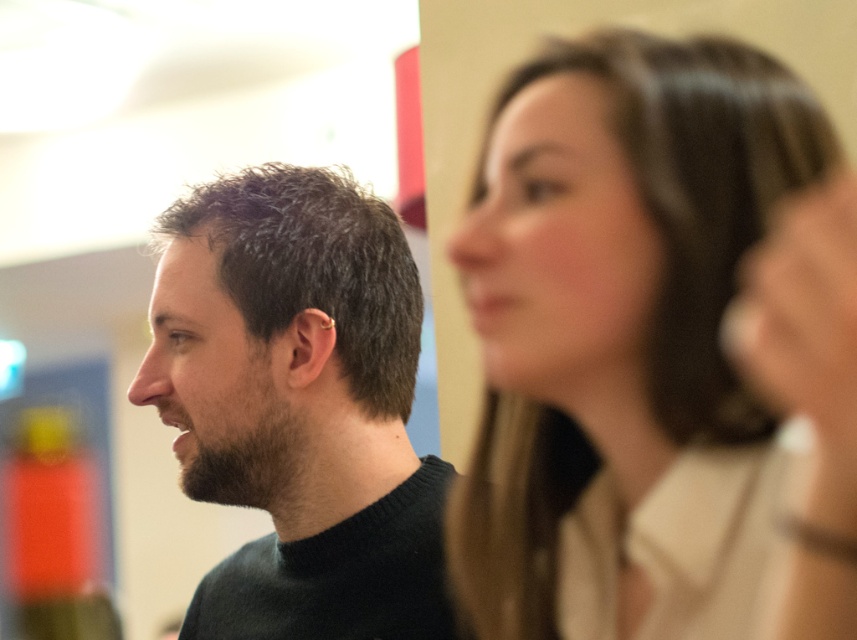
Is point (559, 291) behind point (325, 385)?

No, (559, 291) is in front of (325, 385).

Is the position of smooth beige blouse at upper right more distant than that of dark green sweater at left?

No.

Measure the distance between point (690, 497) and camera.

They are 20.33 inches apart.

At what (x,y) coordinates should I click in order to perform the action: click on smooth beige blouse at upper right. Please return your answer as a coordinate pair (x, y). This screenshot has height=640, width=857. Looking at the image, I should click on (622, 337).